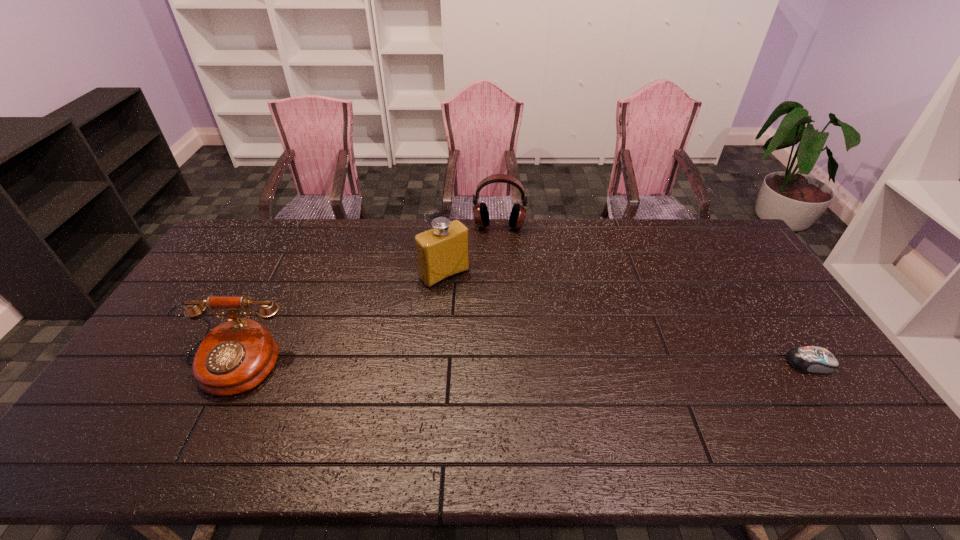
What are the coordinates of `free space on the desktop that is between the leftmost object and the rightmost object and is positioned on the ear pads of the second object from right to left` in the screenshot? It's located at tap(493, 364).

At what (x,y) coordinates should I click in order to perform the action: click on vacant space on the desktop that is between the leftmost object and the computer mouse and is positioned on the front-facing side of the third object from right to left. Please return your answer as a coordinate pair (x, y). Looking at the image, I should click on (529, 363).